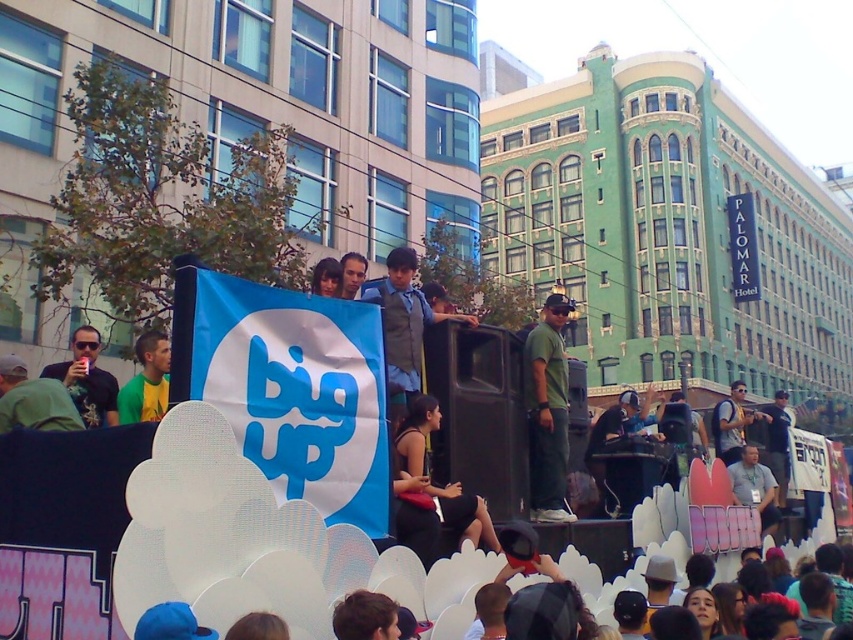
Who is more forward, (x=140, y=396) or (x=351, y=256)?

Point (x=140, y=396)

Where is `green matte shirt at left`? Image resolution: width=853 pixels, height=640 pixels. green matte shirt at left is located at coordinates (146, 380).

Does green matte t-shirt at center have a larger size compared to matte black shirt at center?

No.

Who is more forward, (566, 410) or (724, 426)?

Point (566, 410)

Image resolution: width=853 pixels, height=640 pixels. What are the coordinates of `green matte t-shirt at center` in the screenshot? It's located at (547, 412).

What do you see at coordinates (753, 486) in the screenshot? I see `light blue fabric banner at center` at bounding box center [753, 486].

Is light blue fabric banner at center thinner than dark blue jeans at center?

Correct, light blue fabric banner at center's width is less than dark blue jeans at center's.

Which is behind, point (775, 492) or point (778, 448)?

The point (778, 448) is behind.

Find the location of a particular element. The image size is (853, 640). light blue fabric banner at center is located at coordinates (753, 486).